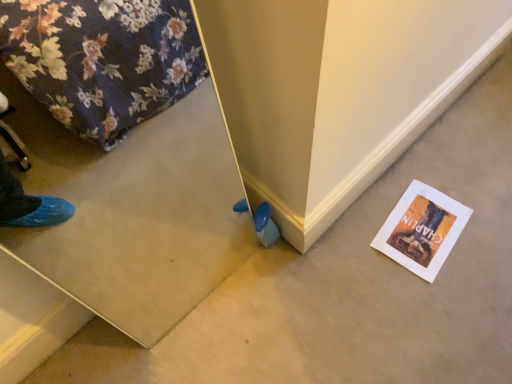
Where is `free spot behind white paper at lower right`? The height and width of the screenshot is (384, 512). free spot behind white paper at lower right is located at coordinates (416, 168).